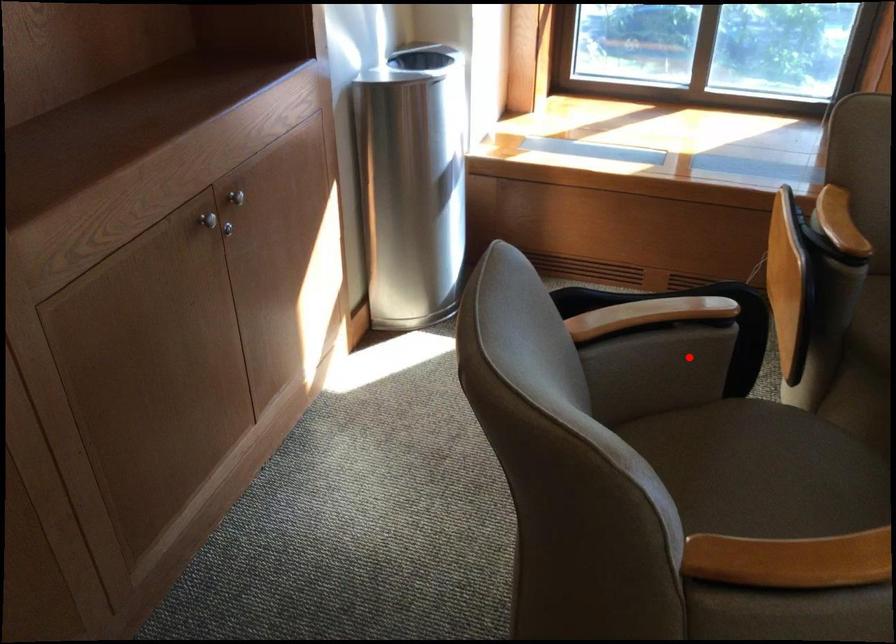
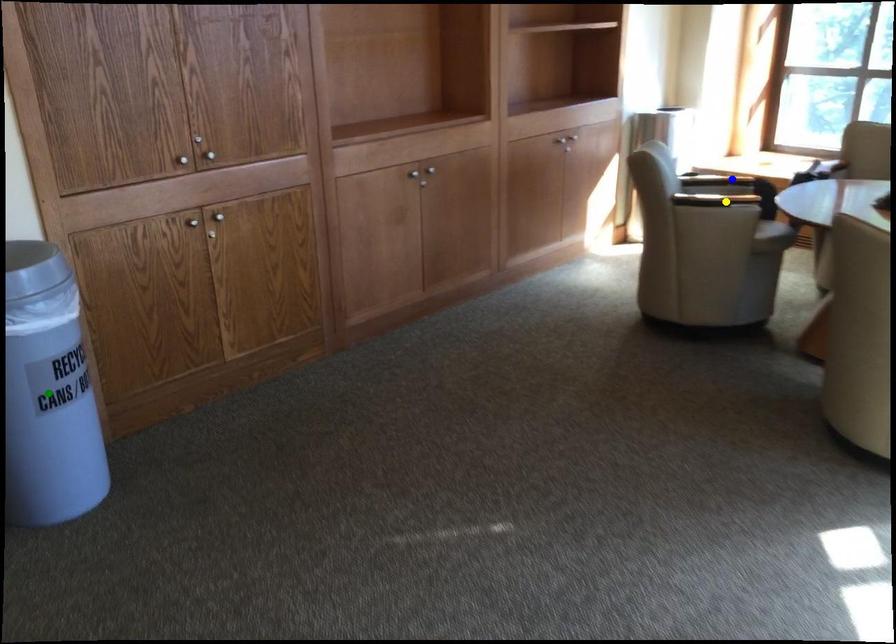
Question: I am providing you with two images of the same scene from different viewpoints. A red point is marked on the first image. You are given multiple points on the second image. Which mark in image 2 goes with the point in image 1?

Choices:
 (A) blue point
 (B) green point
 (C) yellow point

Answer: (A)